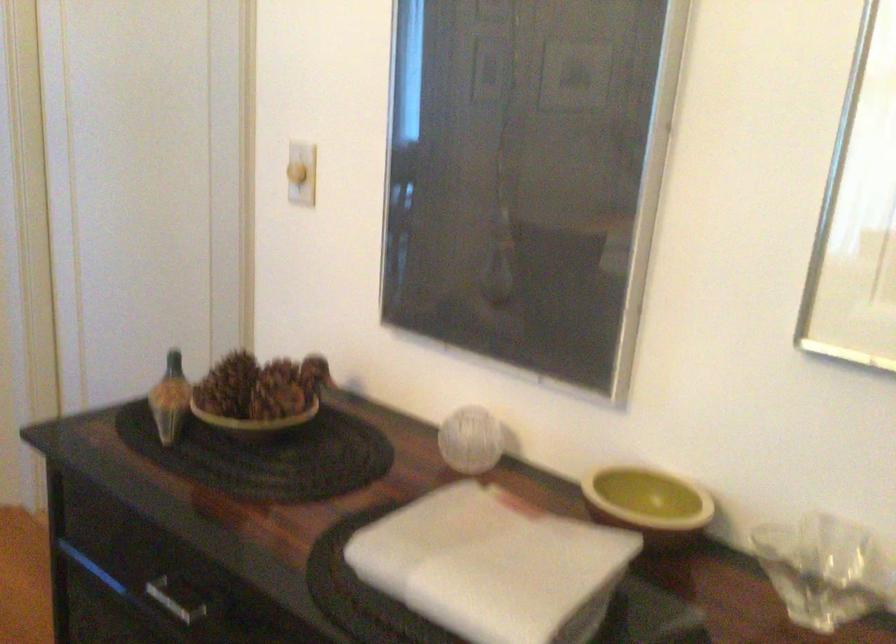
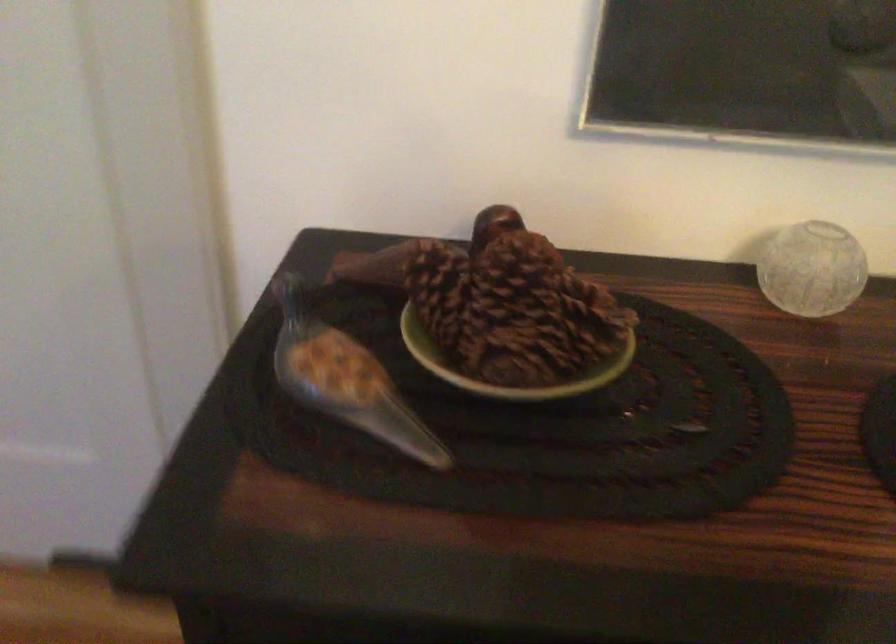
Find the pixel in the second image that matches (159,415) in the first image.

(347, 386)